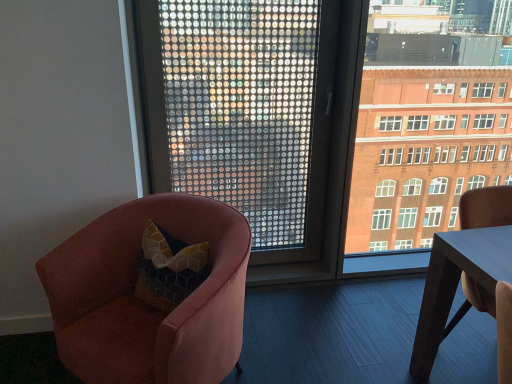
Question: Is velvet pink armchair at left taller than brick building at right?

Choices:
 (A) yes
 (B) no

Answer: (B)

Question: Is velvet pink armchair at left oriented away from brick building at right?

Choices:
 (A) no
 (B) yes

Answer: (B)

Question: From the image's perspective, would you say velvet pink armchair at left is positioned over brick building at right?

Choices:
 (A) no
 (B) yes

Answer: (A)

Question: Does velvet pink armchair at left have a larger size compared to brick building at right?

Choices:
 (A) yes
 (B) no

Answer: (A)

Question: Is the surface of velvet pink armchair at left in direct contact with brick building at right?

Choices:
 (A) yes
 (B) no

Answer: (B)

Question: Looking at their shapes, would you say smooth wooden table at right is wider or thinner than brick building at right?

Choices:
 (A) thin
 (B) wide

Answer: (B)

Question: Is point pos(493,256) closer or farther from the camera than point pos(386,100)?

Choices:
 (A) farther
 (B) closer

Answer: (B)

Question: From a real-world perspective, is smooth wooden table at right above or below brick building at right?

Choices:
 (A) above
 (B) below

Answer: (B)

Question: Is smooth wooden table at right taller or shorter than brick building at right?

Choices:
 (A) tall
 (B) short

Answer: (B)

Question: Is transparent glass window at center bigger or smaller than smooth wooden table at right?

Choices:
 (A) big
 (B) small

Answer: (A)

Question: Based on their positions, is transparent glass window at center located to the left or right of smooth wooden table at right?

Choices:
 (A) left
 (B) right

Answer: (A)

Question: From a real-world perspective, is transparent glass window at center positioned above or below smooth wooden table at right?

Choices:
 (A) below
 (B) above

Answer: (B)

Question: Is point click(264, 213) closer or farther from the camera than point click(437, 273)?

Choices:
 (A) farther
 (B) closer

Answer: (A)

Question: Based on their positions, is velvet pink armchair at left located to the left or right of smooth wooden table at right?

Choices:
 (A) right
 (B) left

Answer: (B)

Question: From their relative heights in the image, would you say velvet pink armchair at left is taller or shorter than smooth wooden table at right?

Choices:
 (A) short
 (B) tall

Answer: (A)